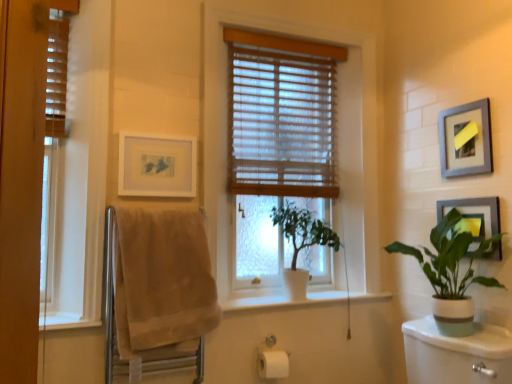
Question: Relative to metallic silver picture frame at upper right, the 2th picture frame from the right, is white matte plant at center, which is counted as the first houseplant, starting from the left, in front or behind?

Choices:
 (A) behind
 (B) front

Answer: (A)

Question: Is white matte plant at center, which is counted as the first houseplant, starting from the left, situated inside metallic silver picture frame at upper right, the 2th picture frame from the right, or outside?

Choices:
 (A) outside
 (B) inside

Answer: (A)

Question: Based on their relative distances, which object is farther from the wooden blinds at left, acting as the 2th window starting from the back?

Choices:
 (A) white matte picture frame at upper left, acting as the first picture frame starting from the left
 (B) wooden blinds at center
 (C) wooden blinds at center, the second window when ordered from front to back
 (D) metallic silver picture frame at upper right, the 2th picture frame from the right
 (E) white ceramic plant at right, which is the 2th houseplant in left-to-right order

Answer: (D)

Question: Which is farther from the wooden blinds at left, acting as the 2th window starting from the back?

Choices:
 (A) wooden blinds at center, arranged as the 2th window when viewed from the left
 (B) metallic silver picture frame at upper right, the 2th picture frame from the right
 (C) white ceramic plant at right, which is the 2th houseplant in left-to-right order
 (D) matte gray picture frame at right, the first picture frame in the right-to-left sequence
 (E) wooden blinds at center

Answer: (D)